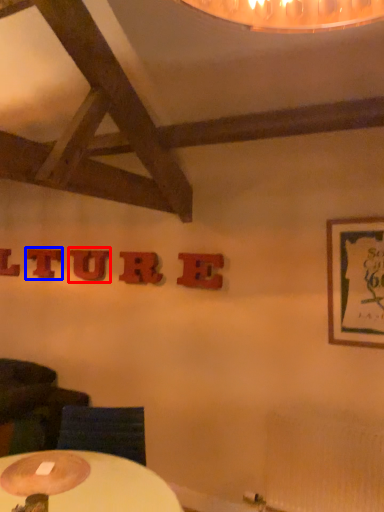
Question: Which of the following is the farthest to the observer, letter (highlighted by a red box) or letter (highlighted by a blue box)?

Choices:
 (A) letter
 (B) letter

Answer: (B)